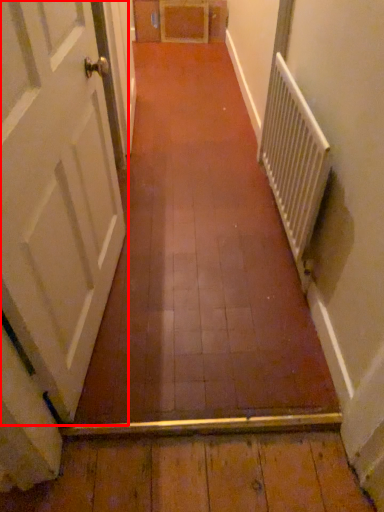
Question: From the image's perspective, what is the correct spatial positioning of door (annotated by the red box) in reference to radiator?

Choices:
 (A) above
 (B) below

Answer: (B)